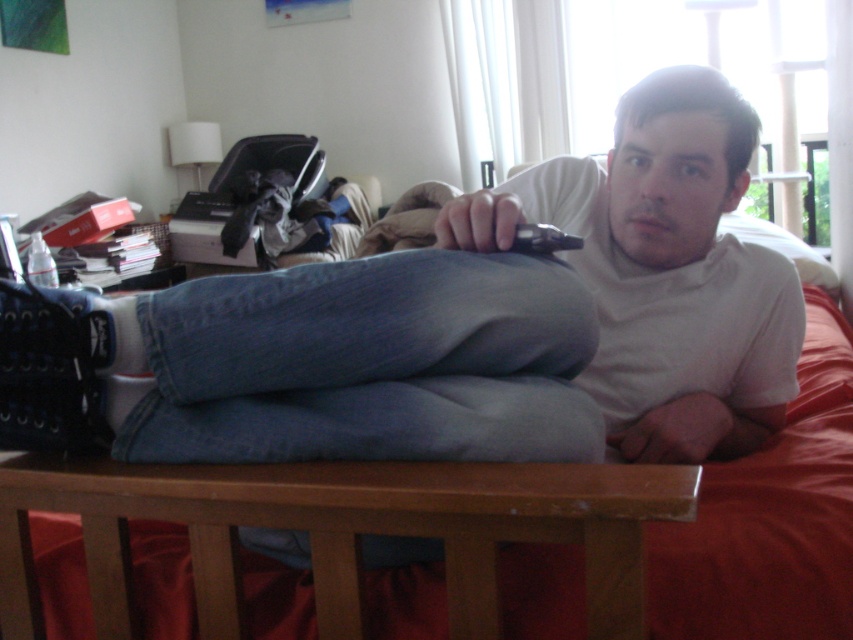
Question: Estimate the real-world distances between objects in this image. Which object is closer to the denim bed at center?

Choices:
 (A) denim jeans at center
 (B) black plastic remote at upper center

Answer: (A)

Question: In this image, where is denim jeans at center located relative to black plastic remote at upper center?

Choices:
 (A) left
 (B) right

Answer: (A)

Question: Which point appears closest to the camera in this image?

Choices:
 (A) (167, 624)
 (B) (370, 314)
 (C) (523, 227)

Answer: (B)

Question: Observing the image, what is the correct spatial positioning of denim jeans at center in reference to black plastic remote at upper center?

Choices:
 (A) right
 (B) left

Answer: (B)

Question: Which point is closer to the camera?

Choices:
 (A) denim jeans at center
 (B) black plastic remote at upper center

Answer: (A)

Question: Does denim jeans at center appear over denim bed at center?

Choices:
 (A) no
 (B) yes

Answer: (B)